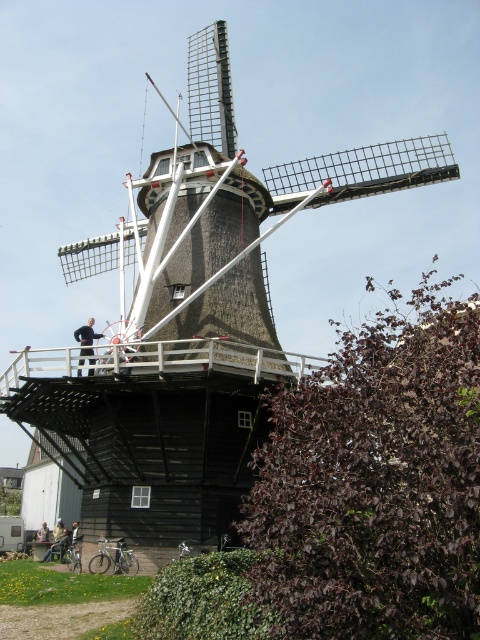
Question: Considering the relative positions of black fabric jacket at upper left and dark blue jeans at lower left in the image provided, where is black fabric jacket at upper left located with respect to dark blue jeans at lower left?

Choices:
 (A) left
 (B) right

Answer: (B)

Question: Is black fabric jacket at upper left wider than dark blue jeans at lower left?

Choices:
 (A) no
 (B) yes

Answer: (B)

Question: Which of the following is the closest to the observer?

Choices:
 (A) dark brown leather jacket at center
 (B) black fabric jacket at upper left
 (C) dark blue jeans at lower left

Answer: (B)

Question: Estimate the real-world distances between objects in this image. Which object is closer to the dark brown leather jacket at center?

Choices:
 (A) black fabric jacket at upper left
 (B) dark blue jeans at lower left

Answer: (B)

Question: Which object is the farthest from the black fabric jacket at upper left?

Choices:
 (A) dark blue jeans at lower left
 (B) dark brown leather jacket at center

Answer: (B)

Question: Considering the relative positions of dark blue jeans at lower left and dark brown leather jacket at center in the image provided, where is dark blue jeans at lower left located with respect to dark brown leather jacket at center?

Choices:
 (A) above
 (B) below

Answer: (A)